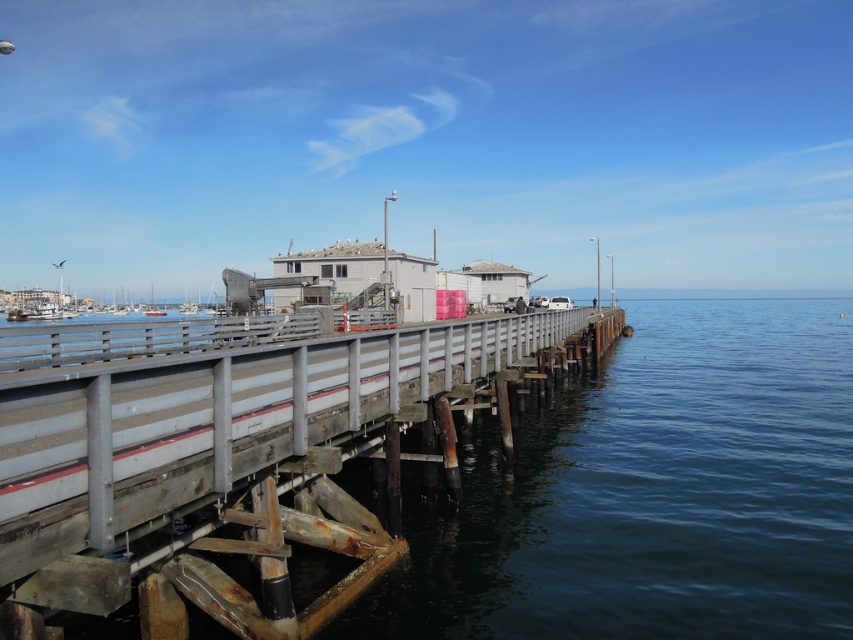
Question: Which point appears farthest from the camera in this image?

Choices:
 (A) (726, 586)
 (B) (86, 545)

Answer: (A)

Question: From the image, what is the correct spatial relationship of dark blue water at center in relation to rusty metal rail at center?

Choices:
 (A) below
 (B) above

Answer: (A)

Question: Can you confirm if dark blue water at center is bigger than rusty metal rail at center?

Choices:
 (A) no
 (B) yes

Answer: (B)

Question: Which point is farther to the camera?

Choices:
 (A) dark blue water at center
 (B) rusty metal rail at center

Answer: (A)

Question: Does dark blue water at center appear on the left side of rusty metal rail at center?

Choices:
 (A) no
 (B) yes

Answer: (A)

Question: Which object appears closest to the camera in this image?

Choices:
 (A) rusty metal rail at center
 (B) dark blue water at center

Answer: (A)